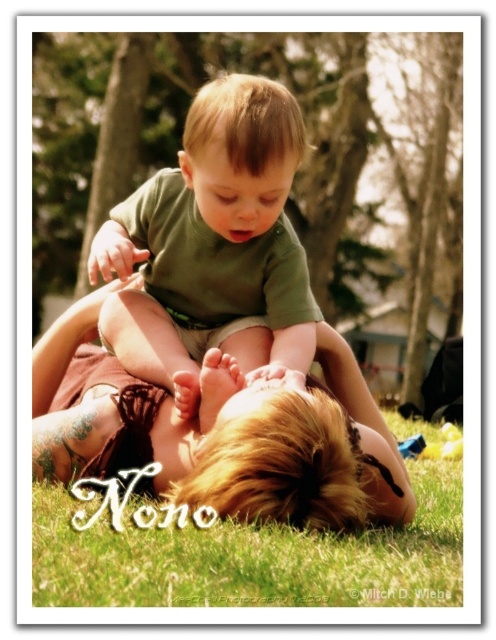
You are standing at the origin point in the image. There is a brown leather boots at lower center located at coordinate point (219, 433). Can you tell me the direction of the brown leather boots at lower center relative to your current position?

The brown leather boots at lower center is located at coordinate point (219, 433), which is to the right and slightly below your current position at the origin.